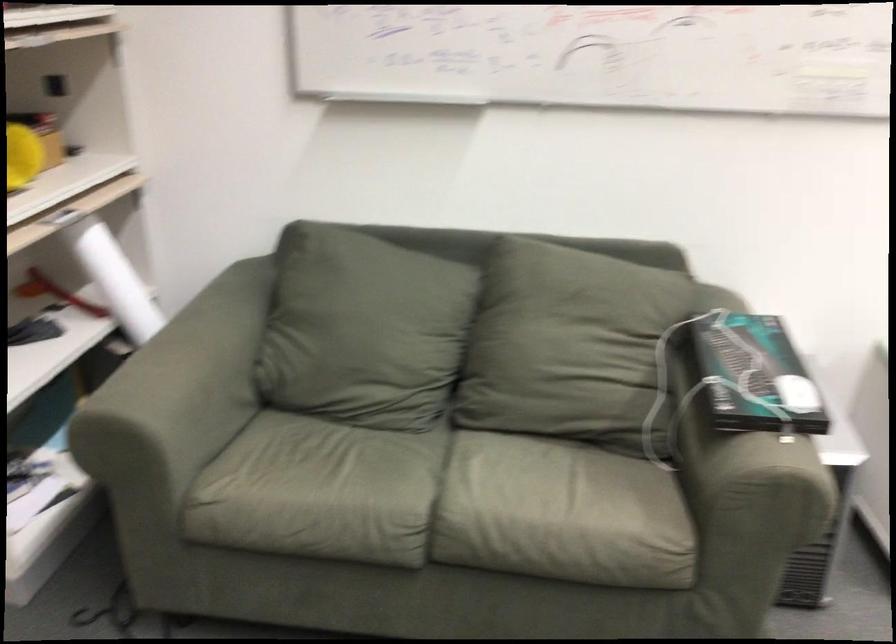
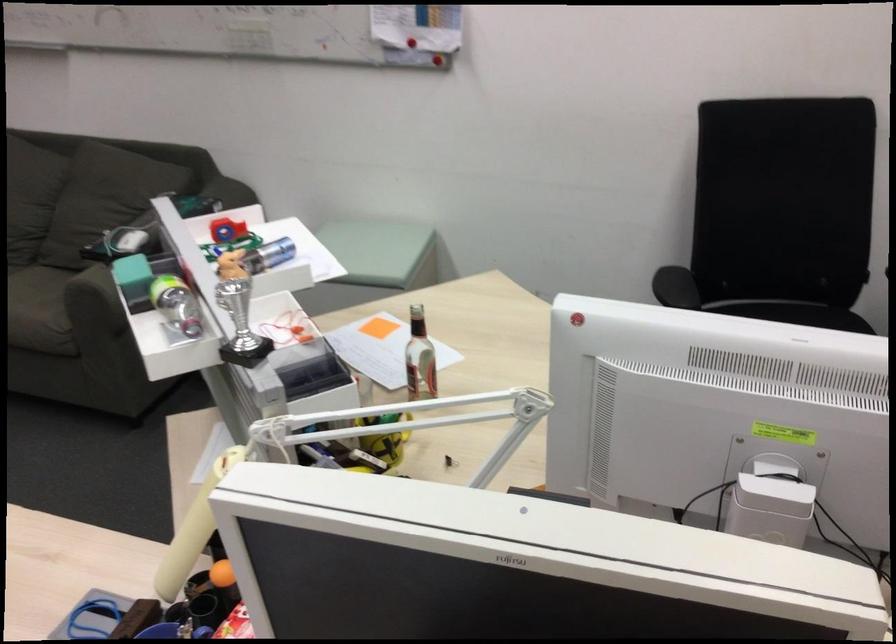
The images are taken continuously from a first-person perspective. In which direction are you moving?

The cameraman moved toward right, backward.